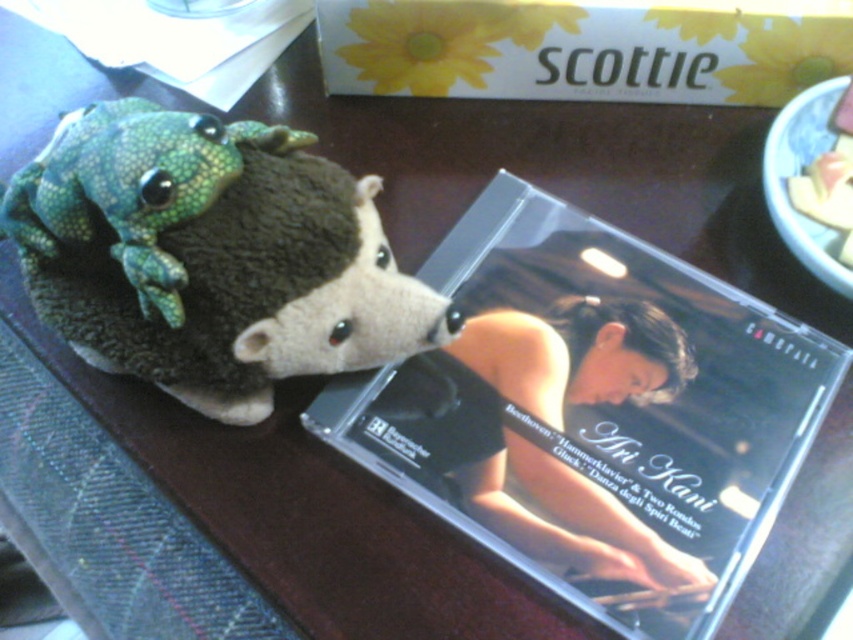
Question: Does clear plastic cd case at upper center appear on the left side of green textured plush frog at upper left?

Choices:
 (A) no
 (B) yes

Answer: (A)

Question: Which object is closer to the camera taking this photo?

Choices:
 (A) clear plastic cd case at upper center
 (B) green fuzzy plush toy at upper left

Answer: (B)

Question: Which of the following is the farthest from the observer?

Choices:
 (A) (302, 140)
 (B) (387, 296)

Answer: (B)

Question: Which point is closer to the camera?

Choices:
 (A) green fuzzy plush toy at upper left
 (B) clear plastic cd case at upper center

Answer: (A)

Question: Is green fuzzy plush toy at upper left positioned at the back of green textured plush frog at upper left?

Choices:
 (A) yes
 (B) no

Answer: (A)

Question: Is green fuzzy plush toy at upper left wider than green textured plush frog at upper left?

Choices:
 (A) no
 (B) yes

Answer: (B)